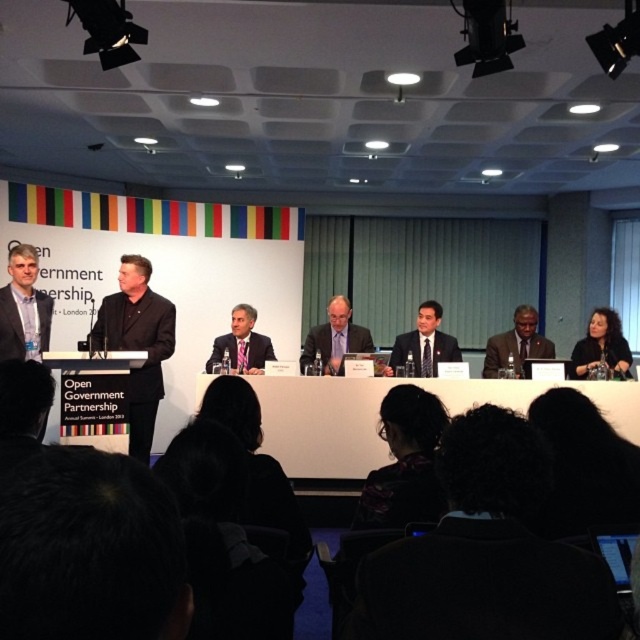
Is dark blue suit at center wider than dark brown suit at center?

Indeed, dark blue suit at center has a greater width compared to dark brown suit at center.

Does dark blue suit at center have a larger size compared to dark brown suit at center?

Incorrect, dark blue suit at center is not larger than dark brown suit at center.

The height and width of the screenshot is (640, 640). Describe the element at coordinates (424, 342) in the screenshot. I see `dark blue suit at center` at that location.

I want to click on dark blue suit at center, so click(x=424, y=342).

Can you confirm if dark curly hair at lower center is bigger than white glossy table at center?

Incorrect, dark curly hair at lower center is not larger than white glossy table at center.

Which is below, dark curly hair at lower center or white glossy table at center?

white glossy table at center is below.

What do you see at coordinates (484, 552) in the screenshot? I see `dark curly hair at lower center` at bounding box center [484, 552].

At what (x,y) coordinates should I click in order to perform the action: click on dark curly hair at lower center. Please return your answer as a coordinate pair (x, y). Looking at the image, I should click on (484, 552).

Can you confirm if black matte suit at center is positioned to the left of matte black suit at center?

Indeed, black matte suit at center is positioned on the left side of matte black suit at center.

Between point (161, 316) and point (227, 337), which one is positioned in front?

Point (161, 316) is in front.

Identify the location of black matte suit at center. (138, 342).